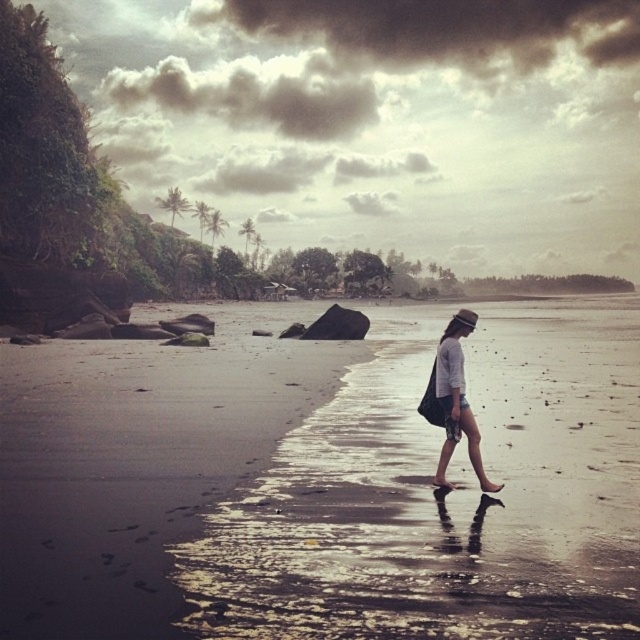
Between wet sand at center and matte gray shorts at center, which one appears on the right side from the viewer's perspective?

Positioned to the right is matte gray shorts at center.

Does point (272, 406) lie behind point (456, 388)?

Yes, it is.

This screenshot has height=640, width=640. In order to click on wet sand at center in this screenshot , I will do (323, 481).